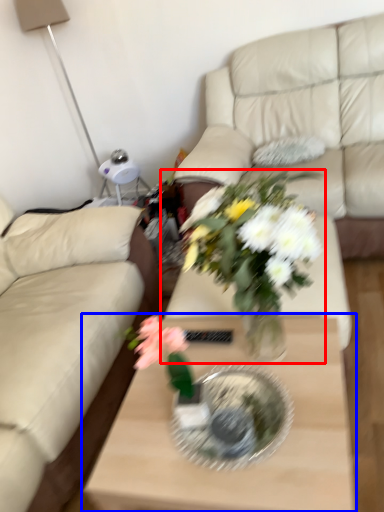
Question: Which point is further to the camera, houseplant (highlighted by a red box) or coffee table (highlighted by a blue box)?

Choices:
 (A) houseplant
 (B) coffee table

Answer: (B)